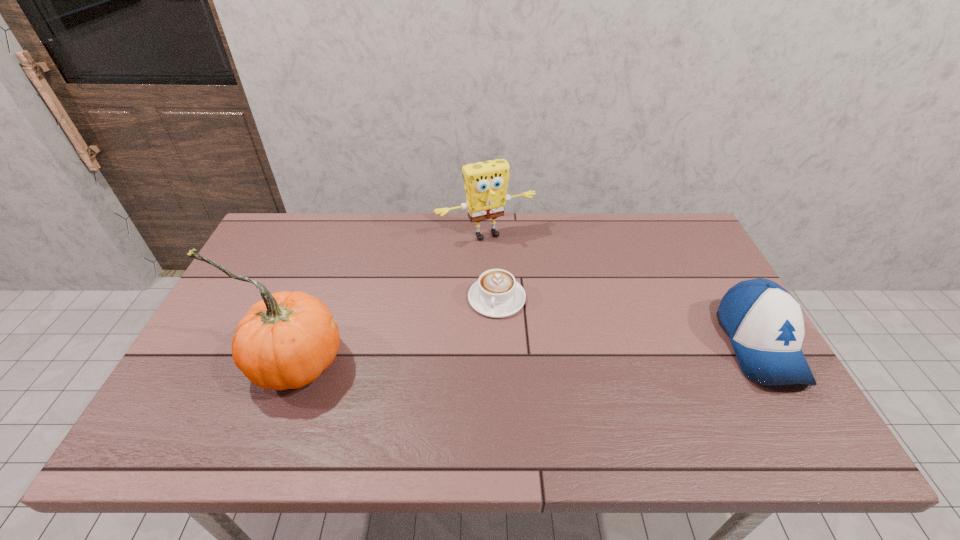
Locate an element on the screen. The image size is (960, 540). vacant space on the desktop that is between the leftmost object and the second shortest object and is positioned on the face of the sponge is located at coordinates (556, 352).

This screenshot has height=540, width=960. In order to click on vacant space on the desktop that is between the leftmost object and the baseball cap and is positioned with the handle on the right side of the cappuccino in this screenshot , I will do `click(491, 354)`.